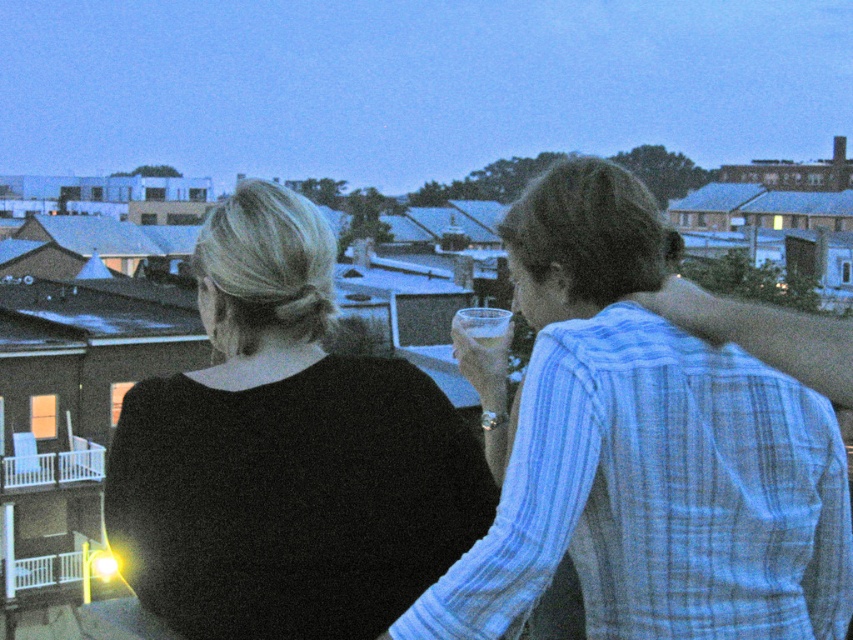
Question: Can you confirm if black matte shirt at upper left is thinner than clear glass at center?

Choices:
 (A) no
 (B) yes

Answer: (B)

Question: Which of the following is the closest to the observer?

Choices:
 (A) (496, 312)
 (B) (299, 634)
 (C) (637, 516)

Answer: (B)

Question: Does light blue striped shirt at upper right appear over black matte shirt at upper left?

Choices:
 (A) no
 (B) yes

Answer: (A)

Question: Which object is closer to the camera taking this photo?

Choices:
 (A) clear glass at center
 (B) black matte shirt at upper left

Answer: (B)

Question: Among these objects, which one is farthest from the camera?

Choices:
 (A) clear glass at center
 (B) black matte shirt at upper left

Answer: (A)

Question: Is light blue striped shirt at upper right to the right of clear glass at center from the viewer's perspective?

Choices:
 (A) yes
 (B) no

Answer: (A)